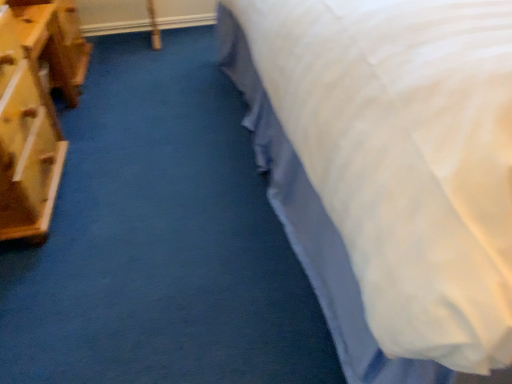
Question: Considering their positions, is white textured bed at upper right located in front of or behind wooden chest of drawers at left?

Choices:
 (A) behind
 (B) front

Answer: (B)

Question: Looking at the image, does white textured bed at upper right seem bigger or smaller compared to wooden chest of drawers at left?

Choices:
 (A) small
 (B) big

Answer: (A)

Question: From a real-world perspective, is white textured bed at upper right positioned above or below wooden chest of drawers at left?

Choices:
 (A) above
 (B) below

Answer: (B)

Question: From the image's perspective, is wooden chest of drawers at left positioned above or below white textured bed at upper right?

Choices:
 (A) above
 (B) below

Answer: (A)

Question: In terms of height, does wooden chest of drawers at left look taller or shorter compared to white textured bed at upper right?

Choices:
 (A) short
 (B) tall

Answer: (B)

Question: From a real-world perspective, relative to white textured bed at upper right, is wooden chest of drawers at left vertically above or below?

Choices:
 (A) above
 (B) below

Answer: (A)

Question: Considering the positions of wooden chest of drawers at left and white textured bed at upper right in the image, is wooden chest of drawers at left wider or thinner than white textured bed at upper right?

Choices:
 (A) wide
 (B) thin

Answer: (B)